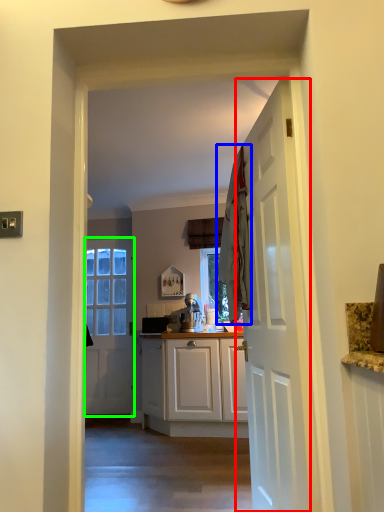
Question: Considering the real-world distances, which object is farthest from door (highlighted by a red box)? laundry (highlighted by a blue box) or door (highlighted by a green box)?

Choices:
 (A) laundry
 (B) door

Answer: (B)